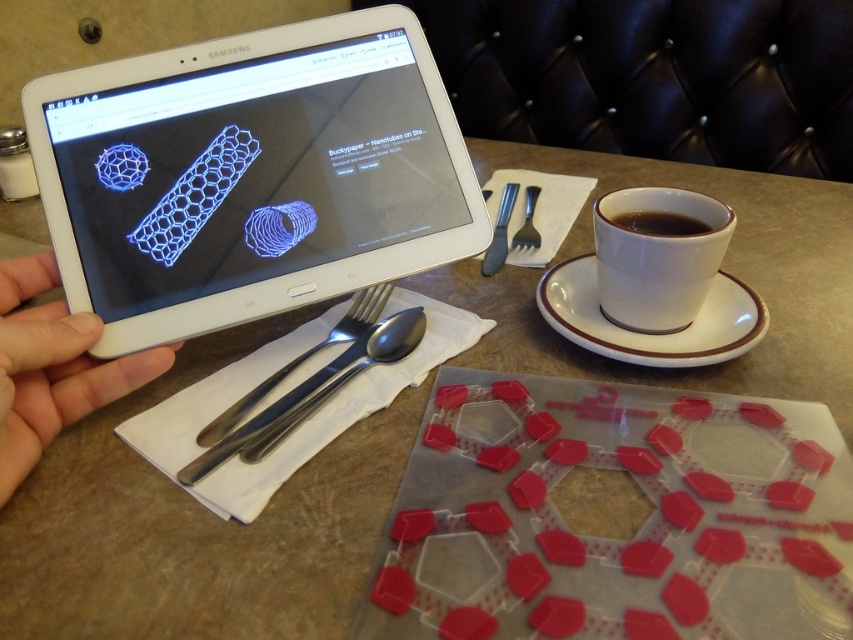
Which is below, white glossy tablet at upper left or satin silver fork at upper center?

Positioned lower is satin silver fork at upper center.

Between point (117, 241) and point (532, 205), which one is positioned behind?

The point (532, 205) is more distant.

Who is more forward, (131, 168) or (531, 228)?

Point (131, 168) is more forward.

I want to click on white glossy tablet at upper left, so pos(250,173).

Which is more to the right, white ceramic saucer at right or black ceramic cup at right?

Positioned to the right is black ceramic cup at right.

Who is higher up, white ceramic saucer at right or black ceramic cup at right?

black ceramic cup at right is higher up.

Where is `white ceramic saucer at right`? The width and height of the screenshot is (853, 640). white ceramic saucer at right is located at coordinates (651, 333).

Locate an element on the screen. white ceramic saucer at right is located at coordinates (651, 333).

Between point (13, 273) and point (497, 212), which one is positioned behind?

Point (497, 212)

Is white plastic tablet at upper left taller than silvermetallicfork at right?

Correct, white plastic tablet at upper left is much taller as silvermetallicfork at right.

Between point (42, 307) and point (497, 234), which one is positioned behind?

The point (497, 234) is behind.

Find the location of a particular element. Image resolution: width=853 pixels, height=640 pixels. white plastic tablet at upper left is located at coordinates (51, 365).